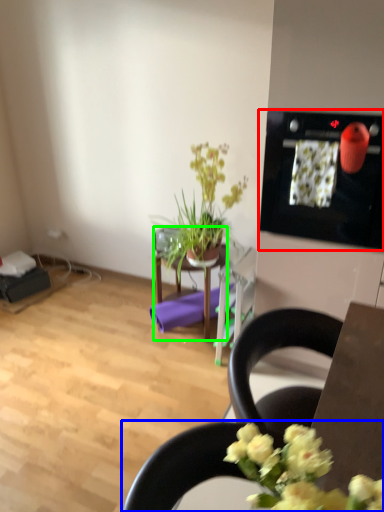
Question: Which object is positioned farthest from appliance (highlighted by a red box)? Select from chair (highlighted by a blue box) and table (highlighted by a green box).

Choices:
 (A) chair
 (B) table

Answer: (A)